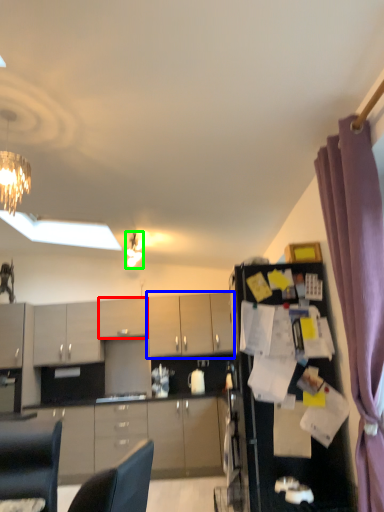
Question: Which object is the farthest from cabinetry (highlighted by a red box)? Choose among these: cabinetry (highlighted by a blue box) or light fixture (highlighted by a green box).

Choices:
 (A) cabinetry
 (B) light fixture

Answer: (B)